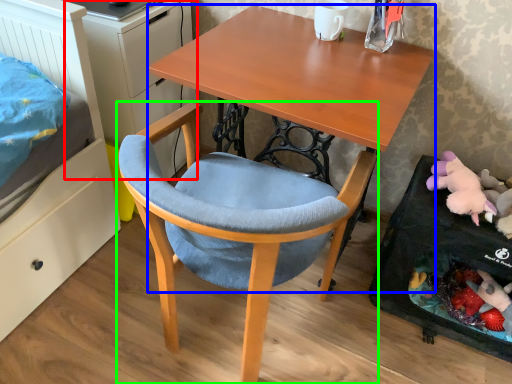
Question: Which object is the closest to the dresser (highlighted by a red box)? Choose among these: desk (highlighted by a blue box) or chair (highlighted by a green box).

Choices:
 (A) desk
 (B) chair

Answer: (A)